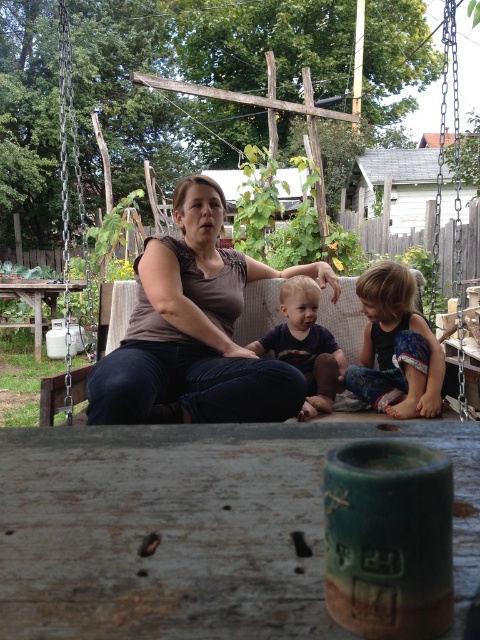
You are standing at the wooden picnic table at center and want to hand a napkin to someone wearing the floral fabric dress at lower right. Can you reach them without moving from the table?

The floral fabric dress at lower right is 5.54 meters away from the wooden picnic table at center. Since the average human arm length is about 0.7 meters, you cannot reach them without moving from the table.

Consider the image. You are standing in the backyard looking at the swing set. There are two points marked on the ground near the swing set. One is at coordinate point (140, 262) and the other is at coordinate point (10, 413). Which point is closer to you?

Point (140, 262) is closer to the viewer than point (10, 413).

You are planning to place a tall plant next to the floral fabric dress at lower right and the wooden picnic table at center. Which object should the plant be placed closer to to ensure it doesn

The plant should be placed closer to the wooden picnic table at center because the floral fabric dress at lower right is not as tall as the wooden picnic table at center, so the taller object would provide better stability and visibility for the plant.